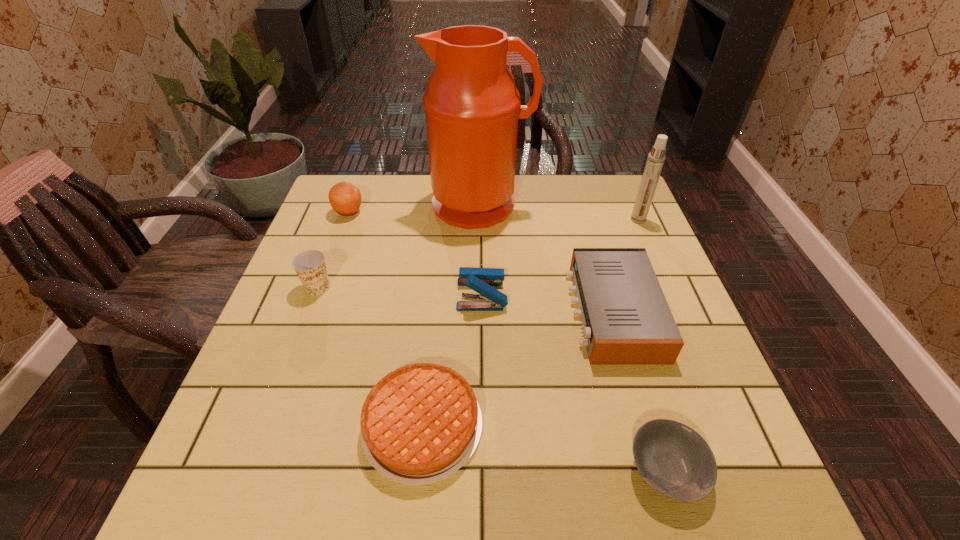
Locate an element on the screen. Image resolution: width=960 pixels, height=540 pixels. vacant space located 0.240m on the front of the rightmost object is located at coordinates (665, 282).

Locate an element on the screen. Image resolution: width=960 pixels, height=540 pixels. free space located on the front of the orange is located at coordinates (310, 320).

At what (x,y) coordinates should I click in order to perform the action: click on free space located 0.300m on the left of the stapler. Please return your answer as a coordinate pair (x, y). The image size is (960, 540). Looking at the image, I should click on (333, 294).

In order to click on free space located on the front of the Dixie cup in this screenshot , I will do `click(308, 314)`.

The image size is (960, 540). Find the location of `vacant space located 0.130m on the control panel of the third shortest object`. vacant space located 0.130m on the control panel of the third shortest object is located at coordinates pyautogui.click(x=516, y=312).

Locate an element on the screen. vacant space situated on the control panel of the third shortest object is located at coordinates (482, 312).

Identify the location of vacant area situated 0.200m on the control panel of the third shortest object. (486, 312).

I want to click on blank space located 0.120m on the right of the pie, so click(546, 426).

This screenshot has width=960, height=540. Identify the location of vacant area situated 0.050m on the right of the bowl. (734, 470).

Locate an element on the screen. This screenshot has width=960, height=540. water jug located at the far edge is located at coordinates (472, 107).